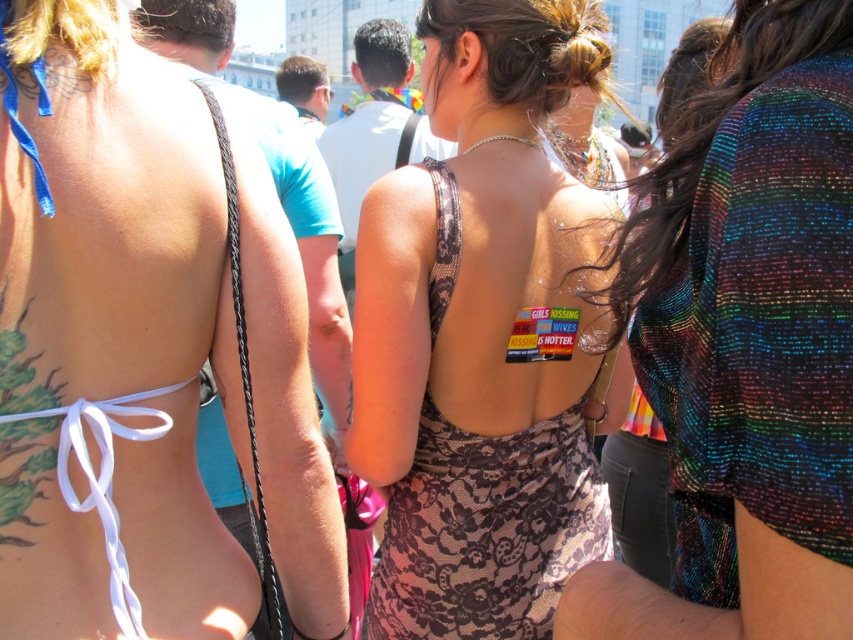
Is point (7, 246) positioned before point (518, 278)?

Yes.

Is matte black bikini top at center positioned at the back of brown lace dress at center?

No, matte black bikini top at center is in front of brown lace dress at center.

Identify the location of matte black bikini top at center. The width and height of the screenshot is (853, 640). (109, 337).

This screenshot has height=640, width=853. Identify the location of matte black bikini top at center. (x=109, y=337).

Can you confirm if brown lace dress at center is shorter than rainbow sequined dress at center?

In fact, brown lace dress at center may be taller than rainbow sequined dress at center.

Which is behind, point (428, 605) or point (830, 412)?

Positioned behind is point (428, 605).

Is point (451, 465) closer to viewer compared to point (819, 552)?

No, it is behind (819, 552).

Find the location of a particular element. Image resolution: width=853 pixels, height=640 pixels. brown lace dress at center is located at coordinates (483, 333).

Where is `matte black bikini top at center`? The height and width of the screenshot is (640, 853). matte black bikini top at center is located at coordinates (109, 337).

Does matte black bikini top at center have a greater height compared to rainbow sequined dress at center?

Yes, matte black bikini top at center is taller than rainbow sequined dress at center.

At what (x,y) coordinates should I click in order to perform the action: click on matte black bikini top at center. Please return your answer as a coordinate pair (x, y). Looking at the image, I should click on (109, 337).